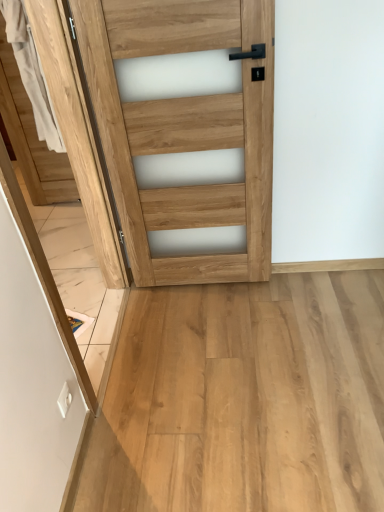
Question: Is point (256, 60) closer or farther from the camera than point (28, 376)?

Choices:
 (A) farther
 (B) closer

Answer: (A)

Question: In terms of width, does natural wood door at center look wider or thinner when compared to natural wood screen door at left?

Choices:
 (A) wide
 (B) thin

Answer: (B)

Question: Considering the positions of natural wood door at center and natural wood screen door at left in the image, is natural wood door at center taller or shorter than natural wood screen door at left?

Choices:
 (A) short
 (B) tall

Answer: (B)

Question: Considering the positions of natural wood screen door at left and natural wood door at center in the image, is natural wood screen door at left taller or shorter than natural wood door at center?

Choices:
 (A) tall
 (B) short

Answer: (B)

Question: From the image's perspective, is natural wood screen door at left positioned above or below natural wood door at center?

Choices:
 (A) above
 (B) below

Answer: (B)

Question: Considering the relative positions of natural wood screen door at left and natural wood door at center in the image provided, is natural wood screen door at left to the left or to the right of natural wood door at center?

Choices:
 (A) left
 (B) right

Answer: (A)

Question: From a real-world perspective, relative to natural wood door at center, is natural wood screen door at left vertically above or below?

Choices:
 (A) below
 (B) above

Answer: (A)